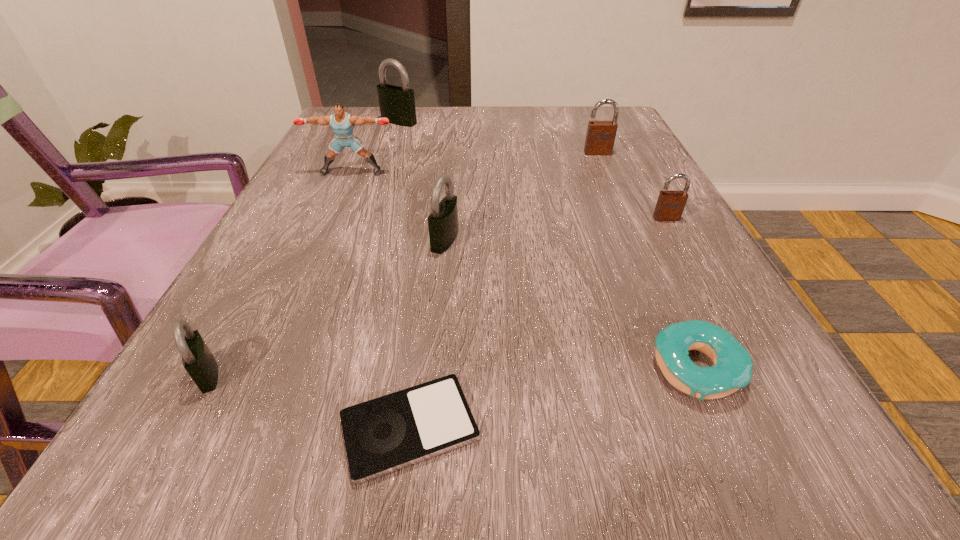
The width and height of the screenshot is (960, 540). Find the location of `the farthest object`. the farthest object is located at coordinates (397, 104).

Locate an element on the screen. The height and width of the screenshot is (540, 960). the second black padlock from right to left is located at coordinates (397, 104).

Image resolution: width=960 pixels, height=540 pixels. Find the location of `red puncher`. red puncher is located at coordinates (342, 123).

Locate an element on the screen. The width and height of the screenshot is (960, 540). the third farthest object is located at coordinates coord(342,123).

Identify the location of the fifth farthest object. (443, 220).

The width and height of the screenshot is (960, 540). I want to click on the rightmost black padlock, so pyautogui.click(x=443, y=220).

What are the coordinates of `the second farthest object` in the screenshot? It's located at (600, 137).

The width and height of the screenshot is (960, 540). Find the location of `the farther brown padlock`. the farther brown padlock is located at coordinates (600, 137).

Identify the location of the leftmost padlock. (199, 362).

You are a GUI agent. You are given a task and a screenshot of the screen. Output one action in this format:
    pyautogui.click(x=<x>, y=<y>)
    Task: Click on the nearest black padlock
    
    Given the screenshot: What is the action you would take?
    pyautogui.click(x=199, y=362)